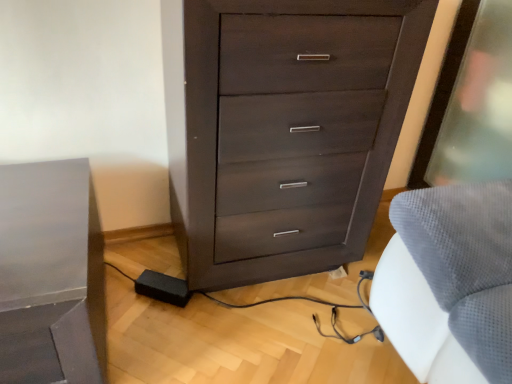
Locate an element on the screen. The width and height of the screenshot is (512, 384). vacant space in front of dark wood chest of drawers at center is located at coordinates point(263,342).